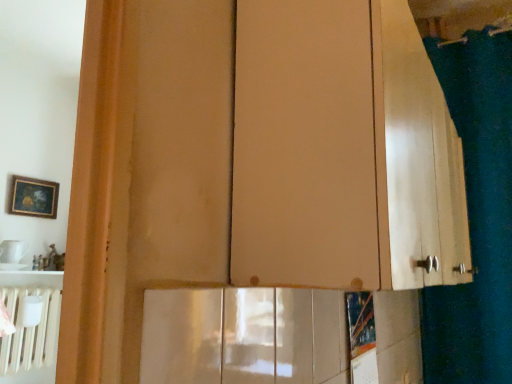
Question: Is matte wood cabinet at center smaller than green fabric shower curtain at right?

Choices:
 (A) no
 (B) yes

Answer: (A)

Question: Is matte wood cabinet at center wider than green fabric shower curtain at right?

Choices:
 (A) yes
 (B) no

Answer: (A)

Question: Is matte wood cabinet at center at the right side of green fabric shower curtain at right?

Choices:
 (A) no
 (B) yes

Answer: (A)

Question: From a real-world perspective, is matte wood cabinet at center beneath green fabric shower curtain at right?

Choices:
 (A) yes
 (B) no

Answer: (A)

Question: Does matte wood cabinet at center touch green fabric shower curtain at right?

Choices:
 (A) yes
 (B) no

Answer: (B)

Question: From a real-world perspective, is matte wood cabinet at center on top of green fabric shower curtain at right?

Choices:
 (A) no
 (B) yes

Answer: (A)

Question: From the image's perspective, is green fabric shower curtain at right over matte wood cabinet at center?

Choices:
 (A) no
 (B) yes

Answer: (A)

Question: Is matte wood cabinet at center completely or partially inside green fabric shower curtain at right?

Choices:
 (A) yes
 (B) no

Answer: (B)

Question: Is green fabric shower curtain at right wider than matte wood cabinet at center?

Choices:
 (A) no
 (B) yes

Answer: (A)

Question: From a real-world perspective, is green fabric shower curtain at right physically below matte wood cabinet at center?

Choices:
 (A) no
 (B) yes

Answer: (A)

Question: Is green fabric shower curtain at right in front of matte wood cabinet at center?

Choices:
 (A) yes
 (B) no

Answer: (B)

Question: Considering the relative positions of green fabric shower curtain at right and matte wood cabinet at center in the image provided, is green fabric shower curtain at right to the left of matte wood cabinet at center from the viewer's perspective?

Choices:
 (A) no
 (B) yes

Answer: (A)

Question: Considering the positions of matte wood cabinet at center and green fabric shower curtain at right in the image, is matte wood cabinet at center wider or thinner than green fabric shower curtain at right?

Choices:
 (A) wide
 (B) thin

Answer: (A)